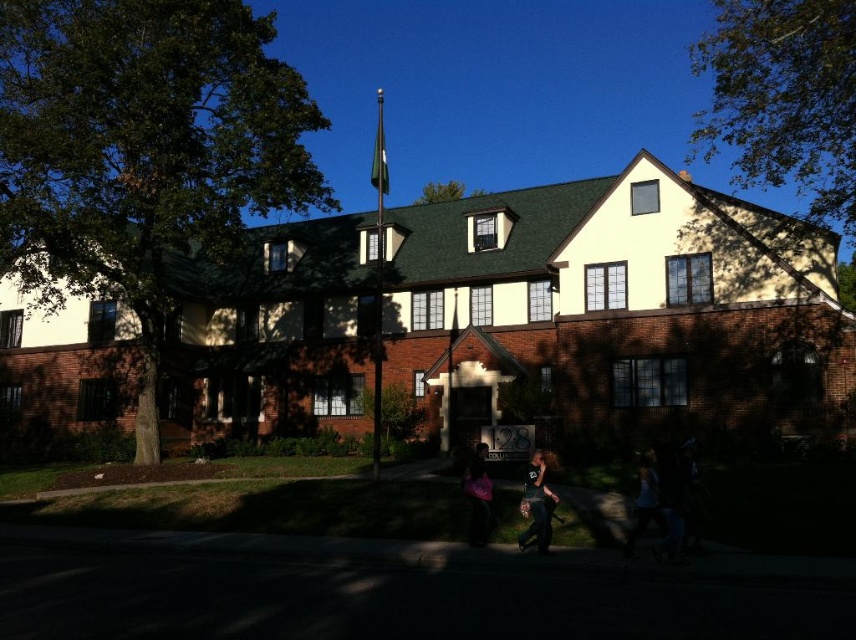
Question: Is matte black shirt at center above pink fabric bag at lower center?

Choices:
 (A) yes
 (B) no

Answer: (B)

Question: Does white matte building at center have a larger size compared to pink fabric bag at lower center?

Choices:
 (A) no
 (B) yes

Answer: (B)

Question: Which point is farther to the camera?

Choices:
 (A) (562, 220)
 (B) (539, 522)
 (C) (629, 552)
 (D) (485, 512)

Answer: (A)

Question: Estimate the real-world distances between objects in this image. Which object is farther from the matte black shirt at center?

Choices:
 (A) white tank top at lower right
 (B) white matte building at center

Answer: (B)

Question: Considering the real-world distances, which object is farthest from the matte black shirt at center?

Choices:
 (A) white matte building at center
 (B) pink fabric bag at lower center

Answer: (A)

Question: Does white matte building at center have a larger size compared to white tank top at lower right?

Choices:
 (A) yes
 (B) no

Answer: (A)